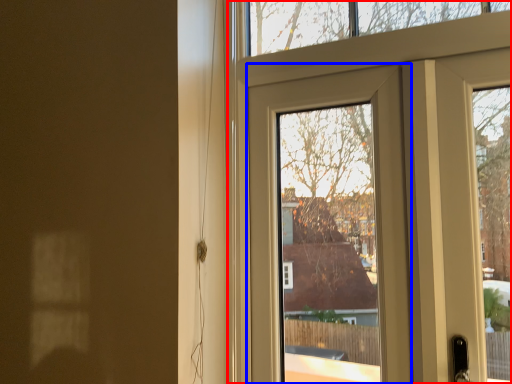
Question: Which point is further to the camera, door (highlighted by a red box) or door (highlighted by a blue box)?

Choices:
 (A) door
 (B) door

Answer: (B)